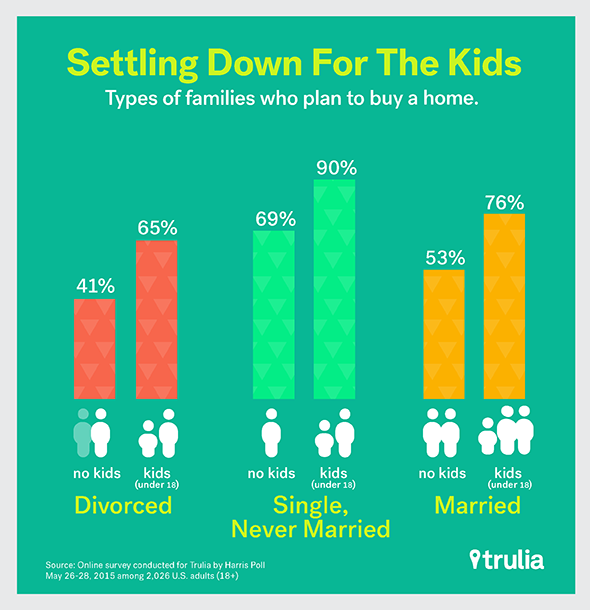
I want to click on pink bar, so click(158, 288), click(95, 337).